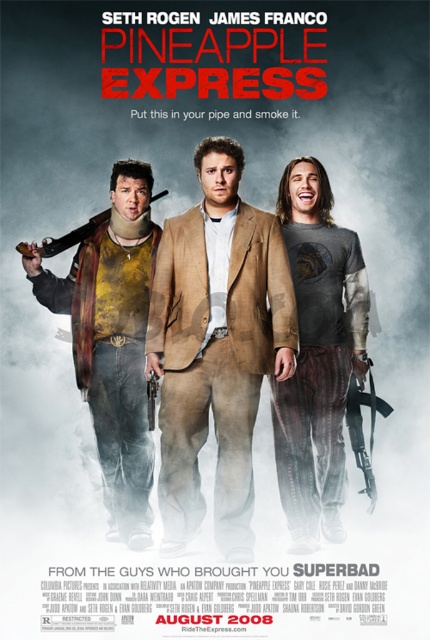
Where is `gray cotton t-shirt at center`? The height and width of the screenshot is (640, 430). gray cotton t-shirt at center is located at coordinates (316, 355).

How much distance is there between gray cotton t-shirt at center and brushed metal jacket at left?

gray cotton t-shirt at center and brushed metal jacket at left are 7.50 feet apart.

The height and width of the screenshot is (640, 430). Find the location of `gray cotton t-shirt at center`. gray cotton t-shirt at center is located at coordinates (316, 355).

Is brown textured suit at center taller than black plastic gun at center?

Yes, brown textured suit at center is taller than black plastic gun at center.

Which is behind, point (236, 163) or point (372, 442)?

Point (372, 442)

Which is in front, point (215, 147) or point (368, 461)?

Point (215, 147) is in front.

Where is `brown textured suit at center`? The height and width of the screenshot is (640, 430). brown textured suit at center is located at coordinates (217, 348).

Can you confirm if brown textured suit at center is positioned below matte brown gun at left?

Indeed, brown textured suit at center is positioned under matte brown gun at left.

Who is more forward, (233, 454) or (166, 193)?

Point (233, 454) is more forward.

At what (x,y) coordinates should I click in order to perform the action: click on brown textured suit at center. Please return your answer as a coordinate pair (x, y). The image size is (430, 640). Looking at the image, I should click on (217, 348).